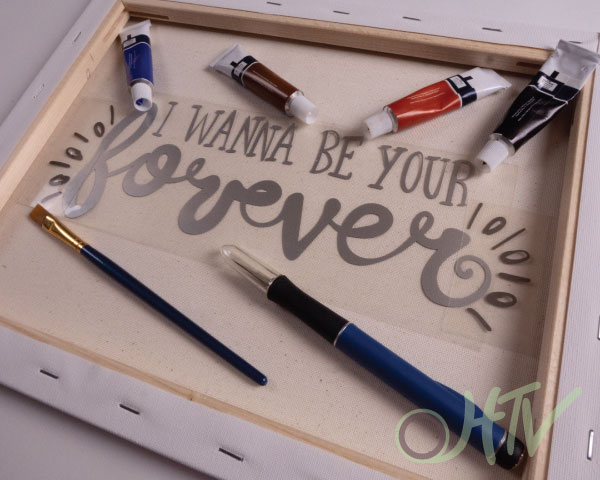
Identify the location of canvas. (52, 366).